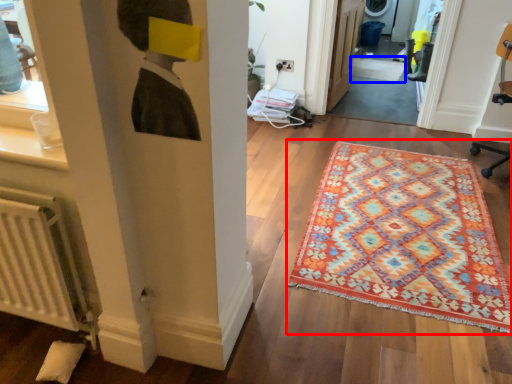
Question: Which point is further to the camera, mat (highlighted by a red box) or doormat (highlighted by a blue box)?

Choices:
 (A) mat
 (B) doormat

Answer: (B)